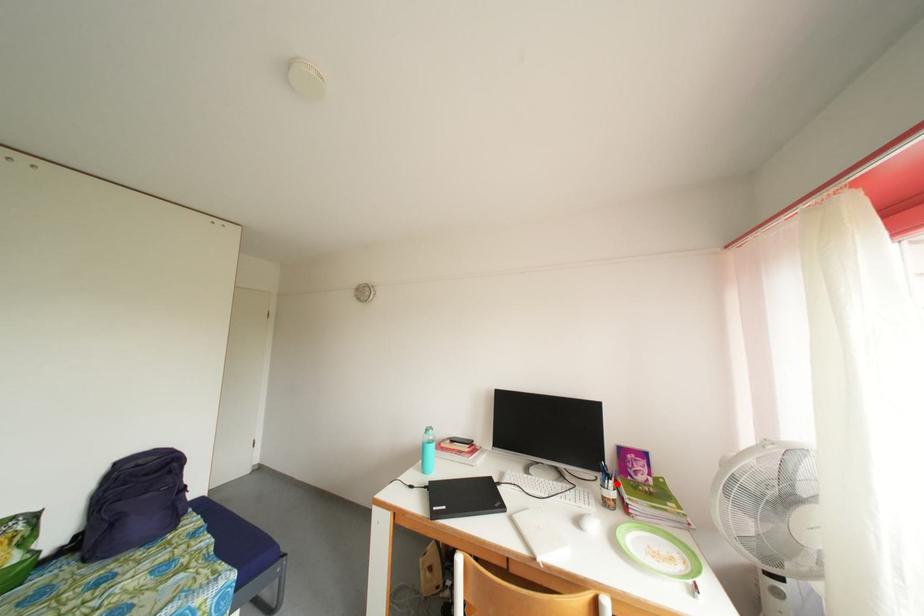
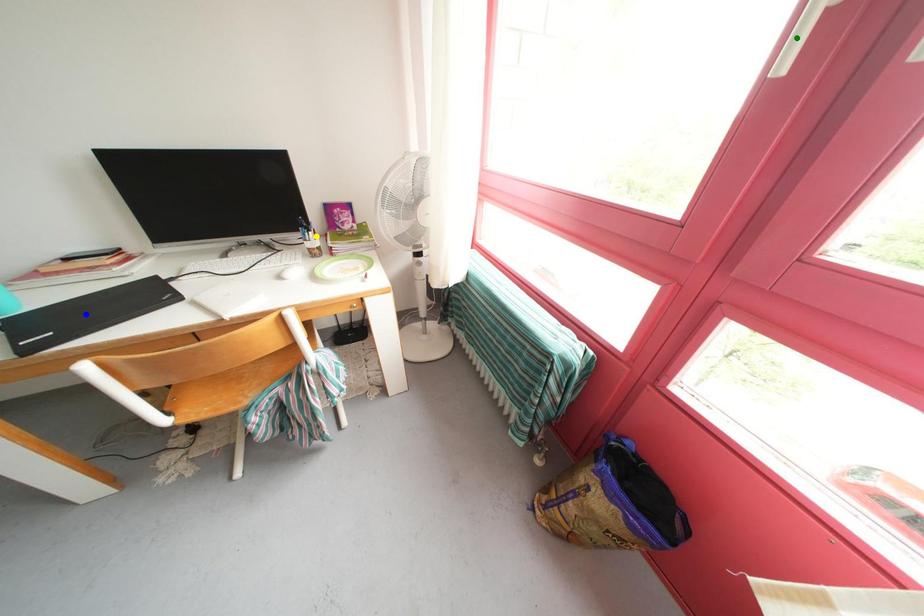
Question: I am providing you with two images of the same scene from different viewpoints. A red point is marked on the first image. You are given multiple points on the second image. Which spot in image 2 lines up with the point in image 1?

Choices:
 (A) blue point
 (B) green point
 (C) yellow point

Answer: (C)